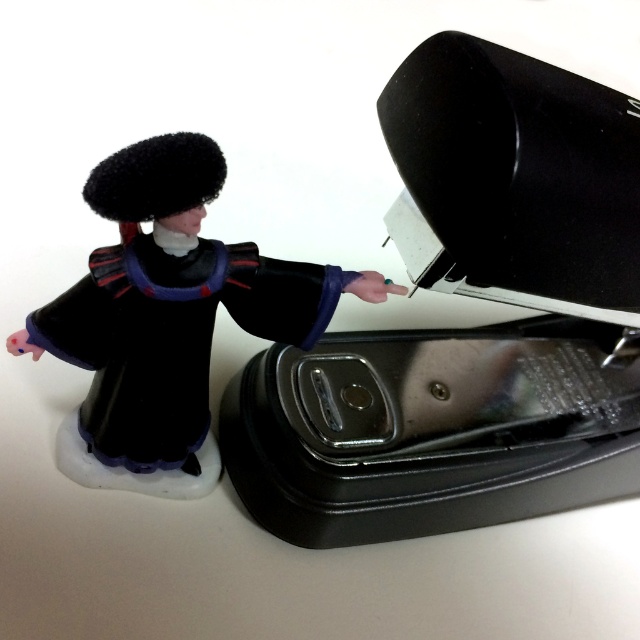
Between black matte stapler at upper right and velvet black robe at left, which one is positioned lower?

black matte stapler at upper right

Measure the distance from black matte stapler at upper right to velvet black robe at left.

24.00 centimeters

Find the location of a particular element. black matte stapler at upper right is located at coordinates (467, 328).

Find the location of `black matte stapler at upper right`. black matte stapler at upper right is located at coordinates (467, 328).